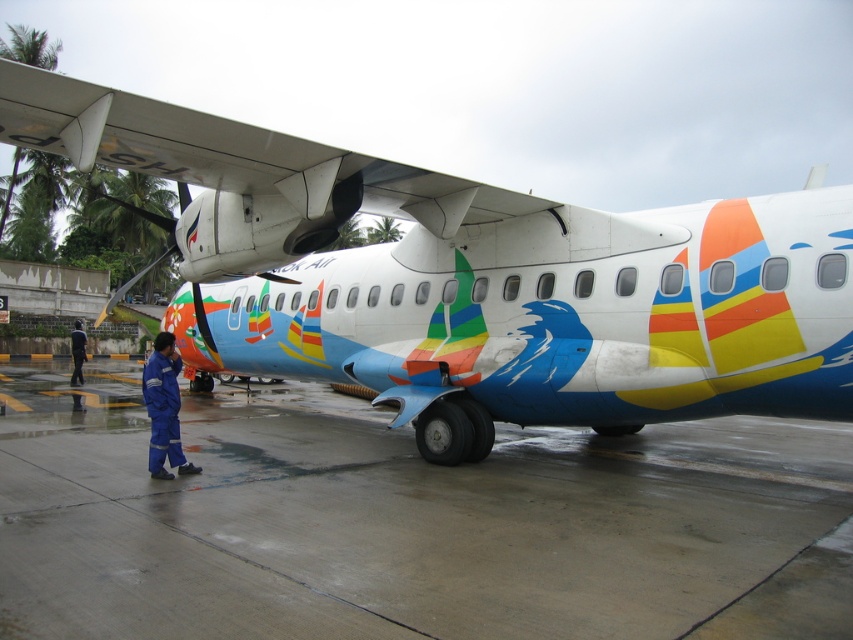
You are standing on the tarmac and see the matte white airplane at center and the blue fabric uniform at center. Which object is positioned to the right?

The matte white airplane at center is to the right of the blue fabric uniform at center.

You are standing at the origin point of the coordinate system. You want to walk to the wet concrete tarmac at lower center. Which direction should you go to reach it?

The wet concrete tarmac at lower center is located at coordinate point (x=408, y=524), so you should move towards the right and forward direction to reach it.

You are a maintenance worker needing to walk from the blue uniform at lower left to the wet concrete tarmac at lower center for inspection. Which direction should you move?

The wet concrete tarmac at lower center is to the right of the blue uniform at lower left, so you should move to the right.